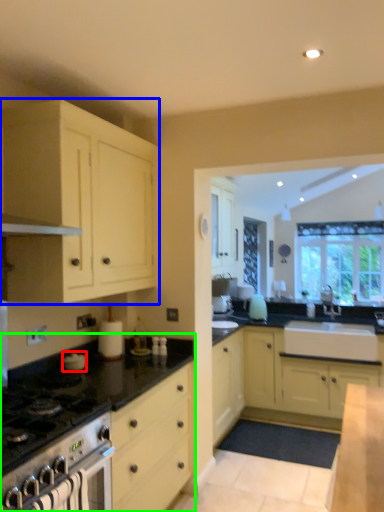
Question: Which object is positioned farthest from appliance (highlighted by a red box)? Select from cabinetry (highlighted by a blue box) and countertop (highlighted by a green box).

Choices:
 (A) cabinetry
 (B) countertop

Answer: (A)